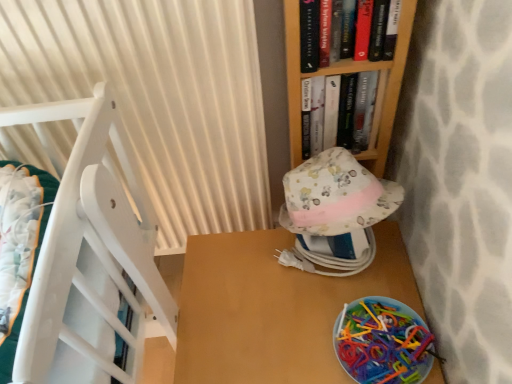
Image resolution: width=512 pixels, height=384 pixels. What are the coordinates of `free spot behind translucent plastic toys at lower right` in the screenshot? It's located at (352, 268).